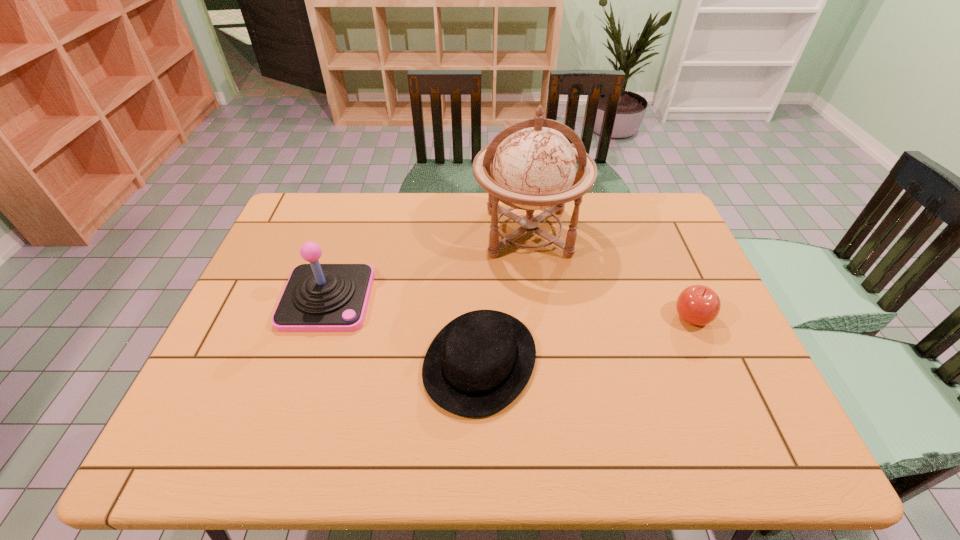
You are a GUI agent. You are given a task and a screenshot of the screen. Output one action in this format:
    pyautogui.click(x=<x>, y=<y>)
    Task: Click on the object positioned at the far edge
    
    Given the screenshot: What is the action you would take?
    (x=533, y=166)

Identify the location of object present at the left edge. The image size is (960, 540). (318, 297).

The image size is (960, 540). Identify the location of object that is positioned at the right edge. (699, 305).

Image resolution: width=960 pixels, height=540 pixels. What are the coordinates of `vacant area at the far edge` in the screenshot? It's located at (364, 194).

Identify the location of vacant space at the near edge of the desktop. The width and height of the screenshot is (960, 540). (455, 450).

In the image, there is a desktop. Find the location of `vacant area at the left edge`. vacant area at the left edge is located at coordinates (x=261, y=399).

This screenshot has height=540, width=960. What are the coordinates of `vacant space at the right edge of the desktop` in the screenshot? It's located at (708, 389).

The height and width of the screenshot is (540, 960). In the image, there is a desktop. What are the coordinates of `vacant area at the far left corner` in the screenshot? It's located at (316, 220).

What are the coordinates of `vacant region at the far right corner of the desktop` in the screenshot? It's located at (660, 233).

At what (x,y) coordinates should I click in order to perform the action: click on vacant region at the near right corner of the desktop. Please return your answer as a coordinate pair (x, y). The image size is (960, 540). Looking at the image, I should click on (790, 454).